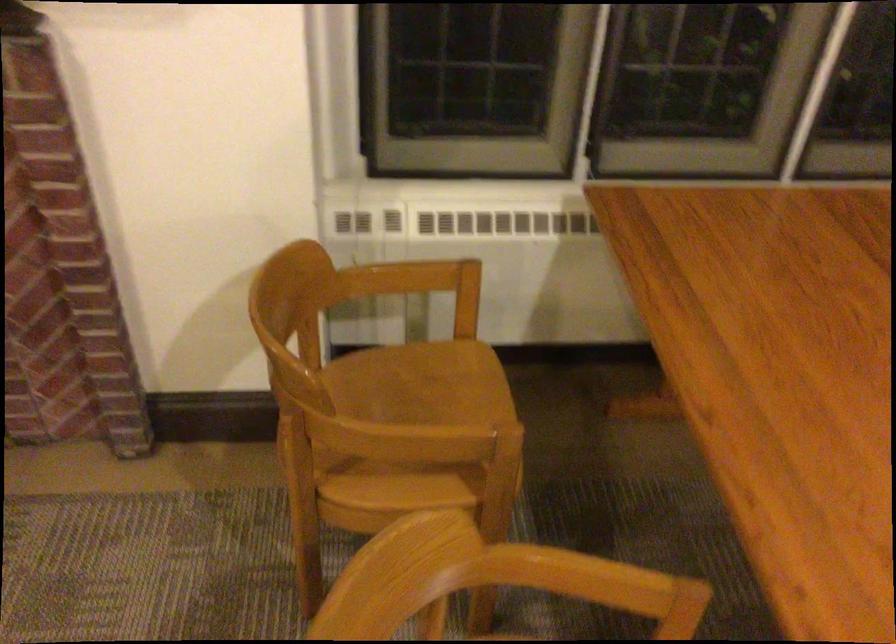
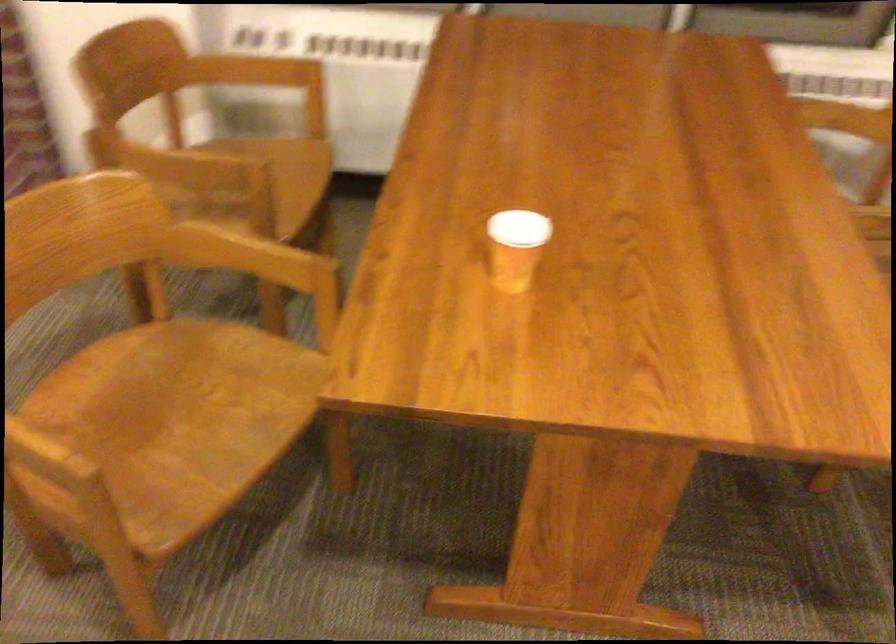
Question: The images are taken continuously from a first-person perspective. In which direction are you moving?

Choices:
 (A) Left
 (B) Right
 (C) Forward
 (D) Backward

Answer: (B)